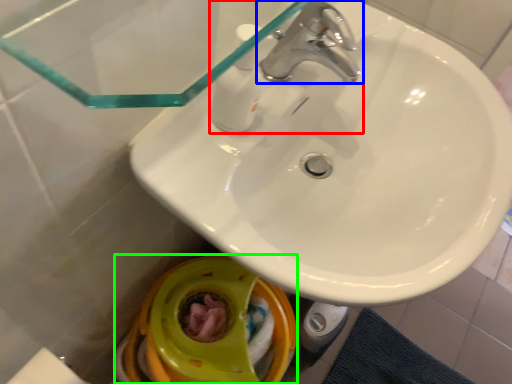
Question: Which is farther away from tap (highlighted by a red box)? tap (highlighted by a blue box) or toilet bowl (highlighted by a green box)?

Choices:
 (A) tap
 (B) toilet bowl

Answer: (B)